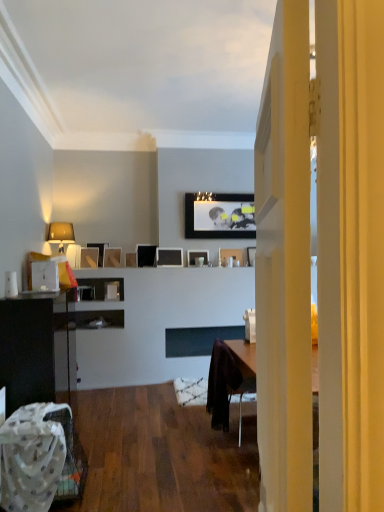
Where is `empty space that is to the right of white fabric chair at lower left`? empty space that is to the right of white fabric chair at lower left is located at coordinates (126, 480).